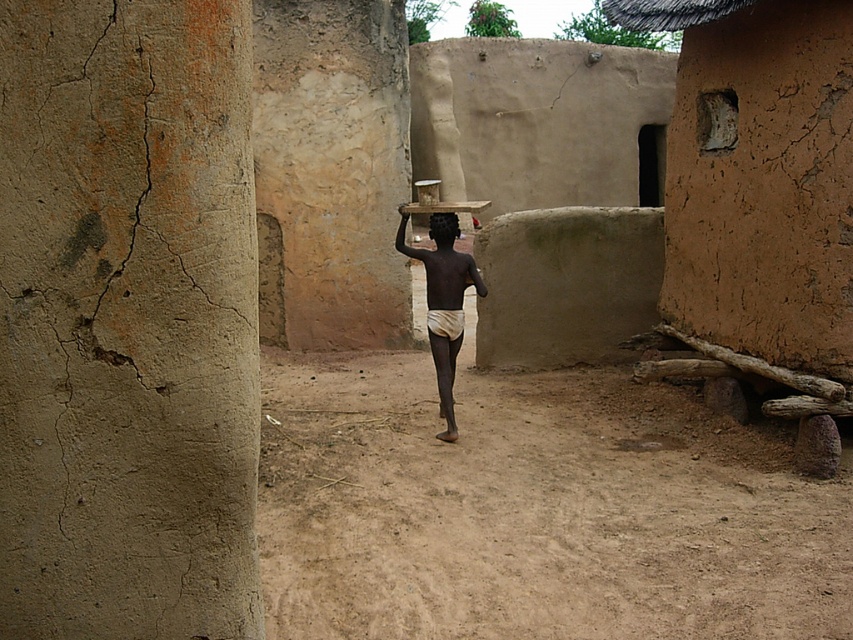
You are a photographer trying to capture the scene of the young boy carrying items on his head. You notice the light beige cloth at center and the black matte head at center. Which object is positioned lower in the image?

The light beige cloth at center is located below the black matte head at center.

You are a photographer standing at the dirt path in the village scene. You want to take a photo of the light beige cloth at center and the black matte head at center. If your camera can only focus on objects within 80 centimeters of each other, will both objects be in focus?

The light beige cloth at center is 82.22 centimeters away from the black matte head at center. Since the distance exceeds the camera focus range of 80 centimeters, both objects will not be in focus simultaneously.

You are a photographer trying to capture the subject in the image. The light beige cloth at center and the black matte head at center are both in focus. Which object is wider?

The light beige cloth at center is wider than the black matte head at center.